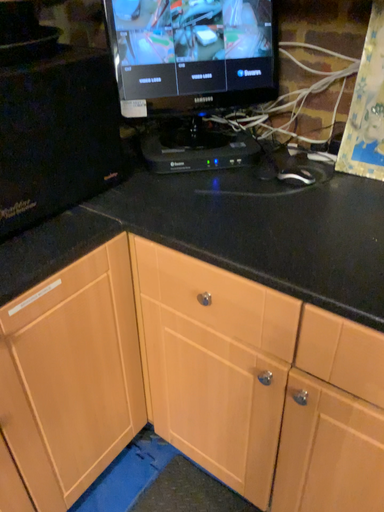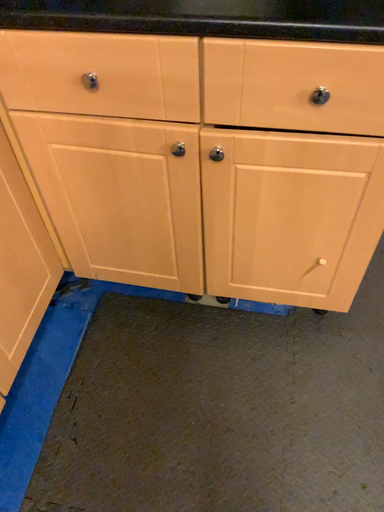
Question: Which way did the camera rotate in the video?

Choices:
 (A) rotated downward
 (B) rotated upward

Answer: (A)